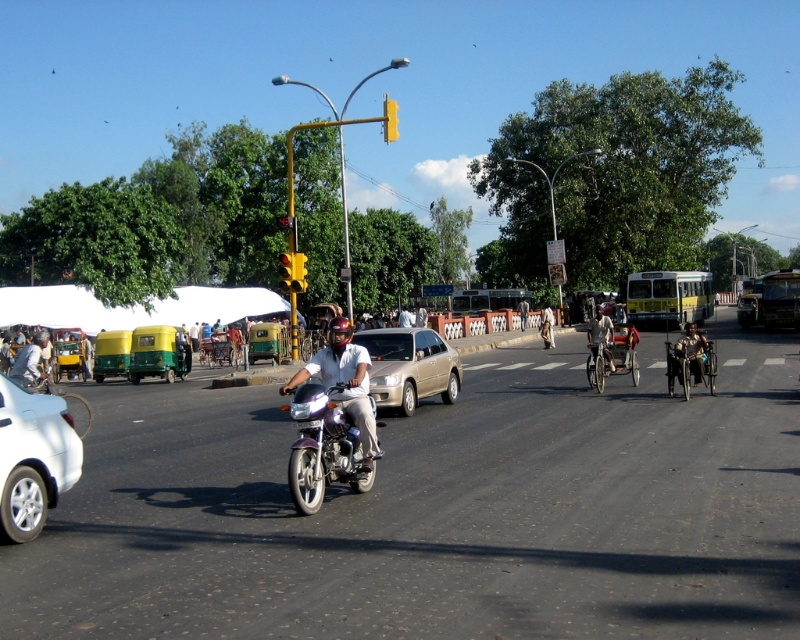
Between white glossy car at lower left and gold metallic sedan at center, which one appears on the left side from the viewer's perspective?

Positioned to the left is white glossy car at lower left.

Is white glossy car at lower left above gold metallic sedan at center?

Actually, white glossy car at lower left is below gold metallic sedan at center.

Between point (0, 483) and point (401, 394), which one is positioned behind?

Positioned behind is point (401, 394).

Locate an element on the screen. The image size is (800, 640). white glossy car at lower left is located at coordinates (34, 458).

Is metallic purple motorcycle at center positioned in front of light brown fabric cloth at center?

Yes, metallic purple motorcycle at center is closer to the viewer.

Who is lower down, metallic purple motorcycle at center or light brown fabric cloth at center?

metallic purple motorcycle at center is below.

In order to click on metallic purple motorcycle at center in this screenshot , I will do point(322,445).

Which of these two, metallic purple motorcycle at center or gold metallic sedan at center, stands taller?

Standing taller between the two is gold metallic sedan at center.

Can you confirm if metallic purple motorcycle at center is positioned to the left of gold metallic sedan at center?

Yes, metallic purple motorcycle at center is to the left of gold metallic sedan at center.

Does point (364, 488) lie behind point (374, 365)?

No, (364, 488) is closer to viewer.

Image resolution: width=800 pixels, height=640 pixels. In order to click on metallic purple motorcycle at center in this screenshot , I will do `click(322, 445)`.